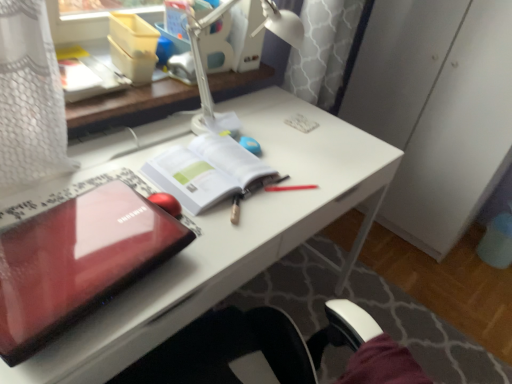
I want to click on free spot to the right of white paper at center, so (x=290, y=185).